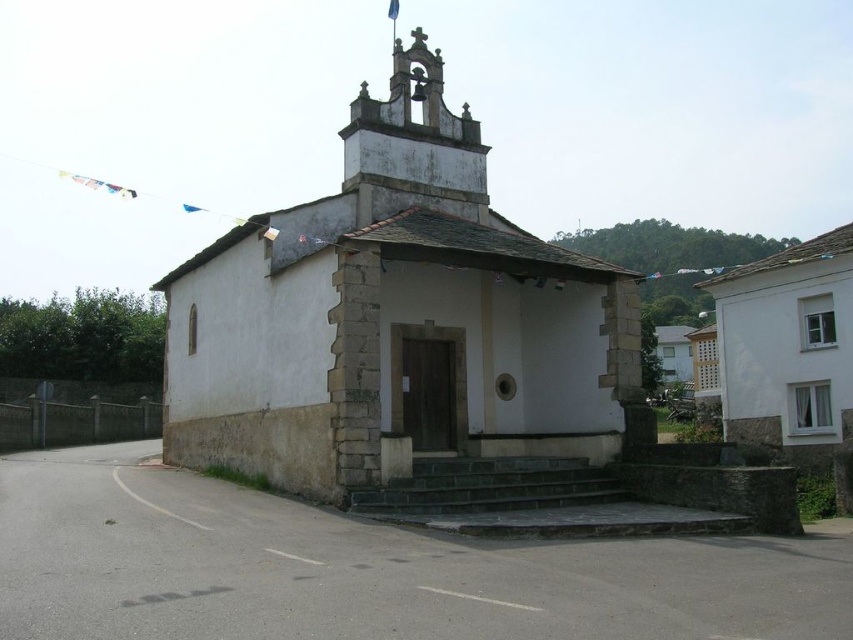
You are standing in front of the church and want to take a photo. You notice two points marked in the scene. The first point is at coordinates point (431, 196) and the second is at point (576, 496). Which point is closer to your camera?

Point (431, 196) is further to the camera than point (576, 496), so the second point is closer to the camera.

You are a delivery person trying to park your van which is 10 meters long. You see the white stone chapel at center and the dark gray stone stairs at center. Is there enough space between them to park your van?

The white stone chapel at center and dark gray stone stairs at center are 11.40 meters apart, so yes, the van can be parked between them since the distance is greater than the van length.

You are a delivery person trying to deliver a package to the white stone chapel at center. The package is too large to carry up the dark gray stone stairs at center. Are the stairs too steep for you to carry the package, or can you manage by using the chapel itself for support?

The white stone chapel at center is taller than the dark gray stone stairs at center. Since the chapel is taller, you can use its structure for support while carrying the package up the stairs.